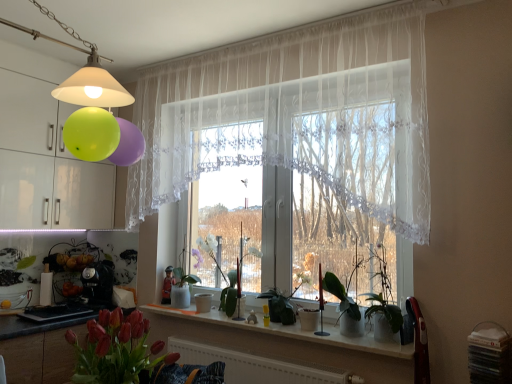
Question: Is white lace curtain at center completely or partially outside of white glossy vase at center, the 1th plant when ordered from left to right?

Choices:
 (A) yes
 (B) no

Answer: (A)

Question: Can you confirm if white lace curtain at center is thinner than white glossy vase at center, the 1th plant when ordered from left to right?

Choices:
 (A) no
 (B) yes

Answer: (B)

Question: Considering the relative sizes of white lace curtain at center and white glossy vase at center, acting as the third plant starting from the front, in the image provided, is white lace curtain at center smaller than white glossy vase at center, acting as the third plant starting from the front,?

Choices:
 (A) no
 (B) yes

Answer: (A)

Question: From the image's perspective, is white lace curtain at center located beneath white glossy vase at center, acting as the third plant starting from the front?

Choices:
 (A) no
 (B) yes

Answer: (A)

Question: From the image's perspective, would you say white lace curtain at center is positioned over white glossy vase at center, which is counted as the 1th plant, starting from the back?

Choices:
 (A) yes
 (B) no

Answer: (A)

Question: Does white lace curtain at center turn towards white glossy vase at center, which is the 3th plant in right-to-left order?

Choices:
 (A) yes
 (B) no

Answer: (A)

Question: Is green matte plant at center, the 1th plant viewed from the front, oriented away from matte white lampshade at upper left?

Choices:
 (A) yes
 (B) no

Answer: (B)

Question: From a real-world perspective, does green matte plant at center, the third plant from the back, sit lower than matte white lampshade at upper left?

Choices:
 (A) no
 (B) yes

Answer: (B)

Question: Does green matte plant at center, marked as the 3th plant in a left-to-right arrangement, come in front of matte white lampshade at upper left?

Choices:
 (A) yes
 (B) no

Answer: (B)

Question: Does green matte plant at center, marked as the 3th plant in a left-to-right arrangement, have a greater height compared to matte white lampshade at upper left?

Choices:
 (A) yes
 (B) no

Answer: (B)

Question: Is green matte plant at center, the 1th plant viewed from the front, wider than matte white lampshade at upper left?

Choices:
 (A) yes
 (B) no

Answer: (B)

Question: Are green matte plant at center, placed as the 1th plant when sorted from right to left, and matte white lampshade at upper left beside each other?

Choices:
 (A) yes
 (B) no

Answer: (B)

Question: Does green matte plant at center, marked as the 2th plant in a left-to-right arrangement, have a lesser width compared to white glossy window sill at center?

Choices:
 (A) yes
 (B) no

Answer: (A)